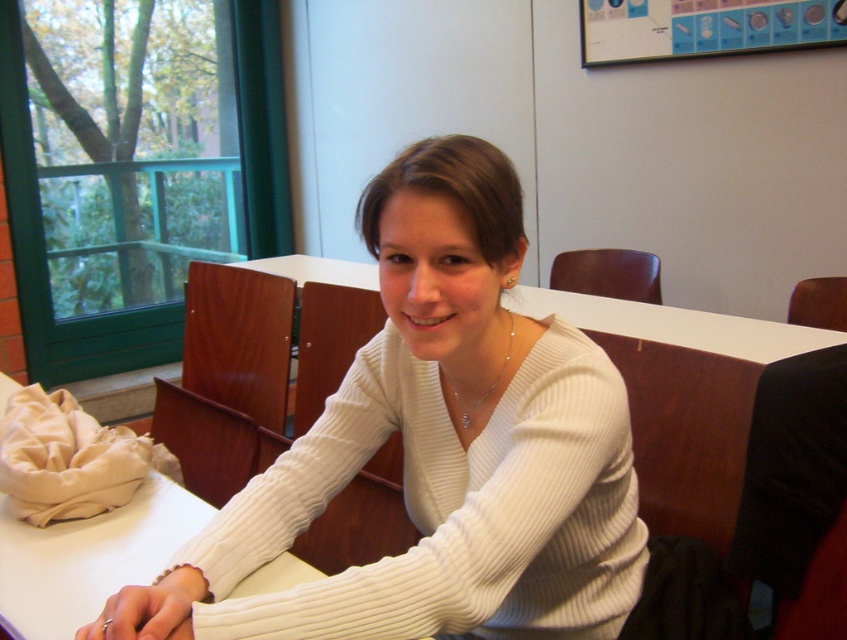
Question: Does white ribbed sweater at center have a smaller size compared to white ribbed sweater at upper center?

Choices:
 (A) yes
 (B) no

Answer: (B)

Question: Which object is farther from the camera taking this photo?

Choices:
 (A) white ribbed sweater at center
 (B) white ribbed sweater at upper center

Answer: (B)

Question: Can you confirm if white ribbed sweater at center is smaller than white ribbed sweater at upper center?

Choices:
 (A) no
 (B) yes

Answer: (A)

Question: Can you confirm if white ribbed sweater at center is positioned to the left of white ribbed sweater at upper center?

Choices:
 (A) yes
 (B) no

Answer: (B)